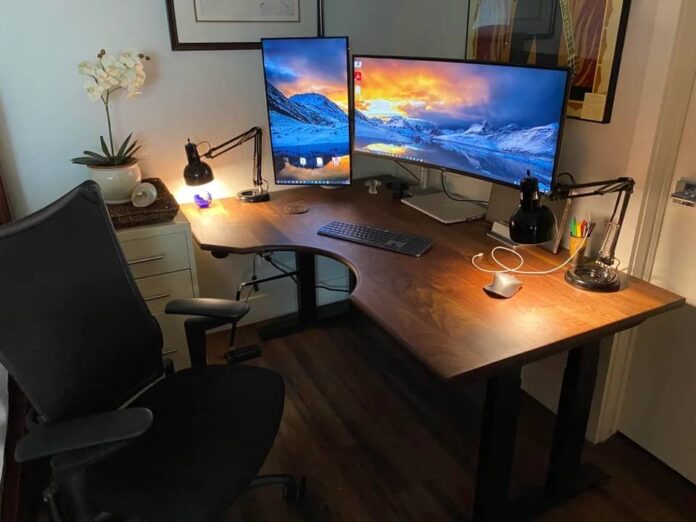
Locate an element on the screen. This screenshot has width=696, height=522. cabinet is located at coordinates (175, 254).